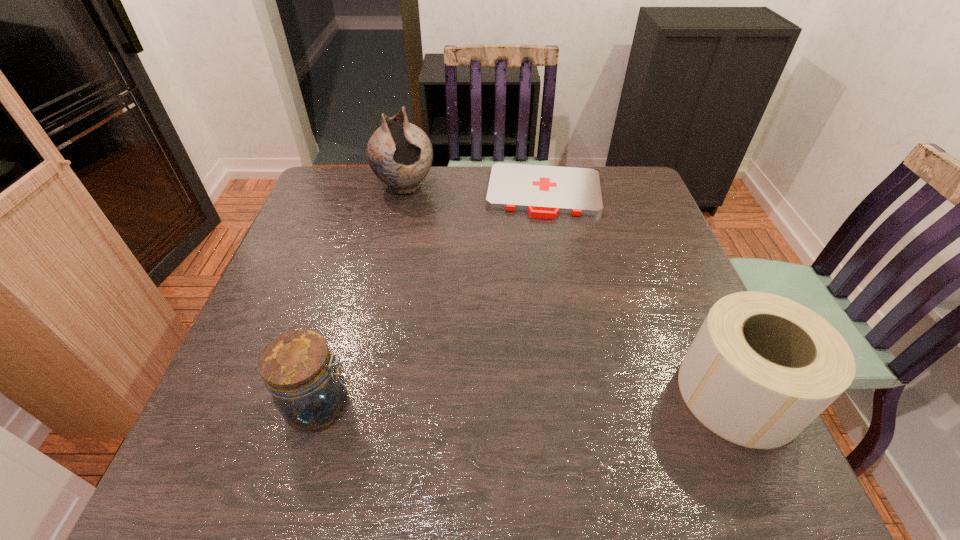
Where is `free space in the image that satisfies the following two spatial constraints: 1. on the front side of the toilet tissue; 2. on the left side of the first-aid kit`? free space in the image that satisfies the following two spatial constraints: 1. on the front side of the toilet tissue; 2. on the left side of the first-aid kit is located at coordinates (580, 393).